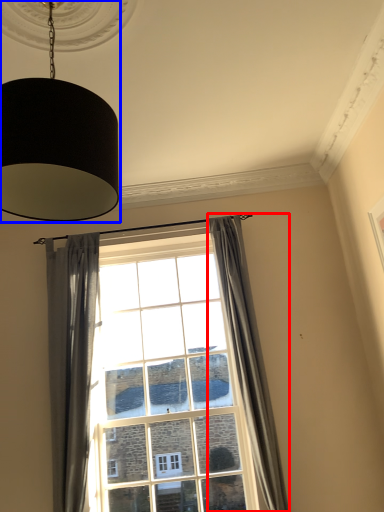
Question: Which object is closer to the camera taking this photo, curtain (highlighted by a red box) or lamp (highlighted by a blue box)?

Choices:
 (A) curtain
 (B) lamp

Answer: (B)